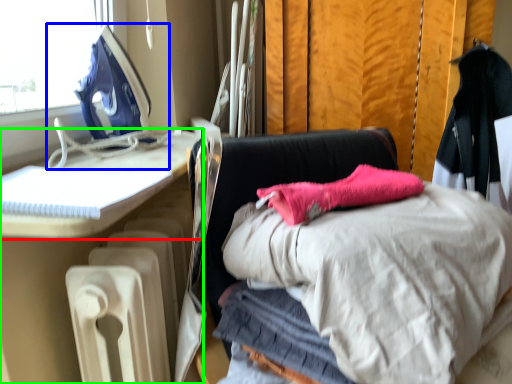
Question: Which object is positioned farthest from furniture (highlighted by a red box)? Select from sewing machine (highlighted by a blue box) and furniture (highlighted by a green box).

Choices:
 (A) sewing machine
 (B) furniture

Answer: (A)